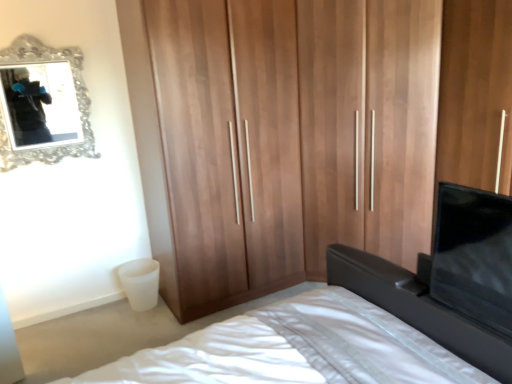
What is the approximate height of wooden wardrobe at center?

wooden wardrobe at center is 7.22 feet tall.

I want to click on wooden wardrobe at center, so [x=284, y=138].

Considering the positions of objects white fabric bed at center and wooden wardrobe at center in the image provided, who is more to the left, white fabric bed at center or wooden wardrobe at center?

white fabric bed at center.

From a real-world perspective, who is located lower, white fabric bed at center or wooden wardrobe at center?

white fabric bed at center, from a real-world perspective.

Is white fabric bed at center not within wooden wardrobe at center?

Yes.

Is point (503, 373) positioned before point (197, 66)?

Yes, point (503, 373) is closer to viewer.

Is wooden wardrobe at center directly adjacent to white fabric bed at center?

No, wooden wardrobe at center is not in contact with white fabric bed at center.

Is wooden wardrobe at center positioned with its back to white fabric bed at center?

wooden wardrobe at center is not turned away from white fabric bed at center.

From the image's perspective, is wooden wardrobe at center beneath white fabric bed at center?

No.

Is wooden wardrobe at center shorter than white fabric bed at center?

No.

Where is `bed above the matte black vanity at lower right (from a real-world perspective)`? bed above the matte black vanity at lower right (from a real-world perspective) is located at coordinates (419, 308).

Which is more to the left, white fabric bed at center or matte black vanity at lower right?

white fabric bed at center is more to the left.

Is there a large distance between white fabric bed at center and matte black vanity at lower right?

white fabric bed at center is near matte black vanity at lower right, not far away.

Which of these two, white fabric bed at center or matte black vanity at lower right, is smaller?

matte black vanity at lower right is smaller.

Is matte black vanity at lower right at the right side of wooden wardrobe at center?

Indeed, matte black vanity at lower right is positioned on the right side of wooden wardrobe at center.

From a real-world perspective, who is located higher, matte black vanity at lower right or wooden wardrobe at center?

wooden wardrobe at center.

Find the location of `cupboard that is behind the matte black vanity at lower right`. cupboard that is behind the matte black vanity at lower right is located at coordinates (284, 138).

Which is behind, matte black vanity at lower right or wooden wardrobe at center?

wooden wardrobe at center is behind.

Which is correct: matte black vanity at lower right is inside white fabric bed at center, or outside of it?

matte black vanity at lower right fits inside white fabric bed at center.

In the image, there is a matte black vanity at lower right. At what (x,y) coordinates should I click in order to perform the action: click on bed above it (from the image's perspective). Please return your answer as a coordinate pair (x, y). This screenshot has height=384, width=512. Looking at the image, I should click on (419, 308).

Is matte black vanity at lower right far from white fabric bed at center?

matte black vanity at lower right is near white fabric bed at center, not far away.

Does point (438, 331) come behind point (480, 355)?

Yes.

Looking at this image, is wooden wardrobe at center aimed at matte black vanity at lower right?

Yes, wooden wardrobe at center is aimed at matte black vanity at lower right.

Which object is positioned more to the left, wooden wardrobe at center or matte black vanity at lower right?

From the viewer's perspective, wooden wardrobe at center appears more on the left side.

At what (x,y) coordinates should I click in order to perform the action: click on cupboard above the matte black vanity at lower right (from a real-world perspective). Please return your answer as a coordinate pair (x, y). Looking at the image, I should click on (284, 138).

Locate an element on the screen. The height and width of the screenshot is (384, 512). bed on the left side of wooden wardrobe at center is located at coordinates (419, 308).

Where is `cupboard above the white fabric bed at center (from a real-world perspective)`? Image resolution: width=512 pixels, height=384 pixels. cupboard above the white fabric bed at center (from a real-world perspective) is located at coordinates (284, 138).

Considering their positions, is matte black vanity at lower right positioned closer to white fabric bed at center than wooden wardrobe at center?

matte black vanity at lower right is positioned closer to the anchor white fabric bed at center.

Looking at the image, which one is located further to matte black vanity at lower right, white fabric bed at center or wooden wardrobe at center?

wooden wardrobe at center is positioned further to the anchor matte black vanity at lower right.

Looking at the image, which one is located closer to white fabric bed at center, wooden wardrobe at center or matte black vanity at lower right?

matte black vanity at lower right is closer to white fabric bed at center.

Looking at the image, which one is located closer to matte black vanity at lower right, wooden wardrobe at center or white fabric bed at center?

Based on the image, white fabric bed at center appears to be nearer to matte black vanity at lower right.

Looking at the image, which one is located further to wooden wardrobe at center, matte black vanity at lower right or white fabric bed at center?

matte black vanity at lower right lies further to wooden wardrobe at center than the other object.

From the image, which object appears to be farther from wooden wardrobe at center, white fabric bed at center or matte black vanity at lower right?

Based on the image, matte black vanity at lower right appears to be further to wooden wardrobe at center.

Find the location of a particular element. The height and width of the screenshot is (384, 512). vanity positioned between white fabric bed at center and wooden wardrobe at center from near to far is located at coordinates (419, 308).